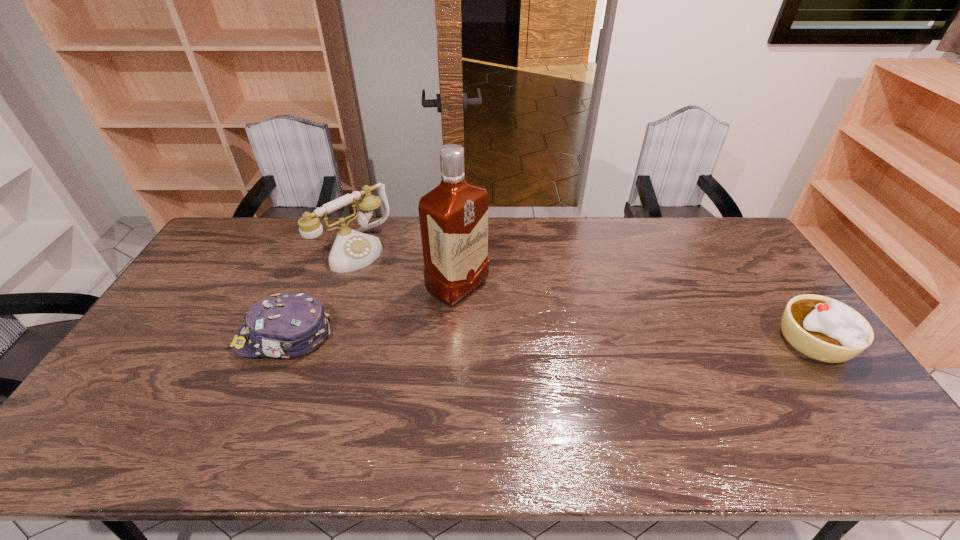
You are a GUI agent. You are given a task and a screenshot of the screen. Output one action in this format:
    pyautogui.click(x=<x>, y=<y>)
    Task: Click on the shortest object
    The height and width of the screenshot is (540, 960).
    Given the screenshot: What is the action you would take?
    pyautogui.click(x=285, y=325)

Where is `the rightmost object`? Image resolution: width=960 pixels, height=540 pixels. the rightmost object is located at coordinates (824, 329).

Identify the location of whipped cream. (824, 329).

Identify the location of the second object from right to left. (453, 216).

Where is `the tallest object`? the tallest object is located at coordinates (453, 216).

At what (x,y) coordinates should I click in order to perform the action: click on telephone. Please return your answer as a coordinate pair (x, y). Looking at the image, I should click on (352, 250).

Where is `free location located 0.070m on the front-facing side of the headwear`? The image size is (960, 540). free location located 0.070m on the front-facing side of the headwear is located at coordinates (211, 337).

Find the location of a particular element. vacant space located 0.240m on the front-facing side of the headwear is located at coordinates (153, 337).

In order to click on blank area located 0.110m on the front-facing side of the headwear in this screenshot , I will do `click(198, 337)`.

Identify the location of vacant point located 0.100m on the left of the second shortest object. (743, 340).